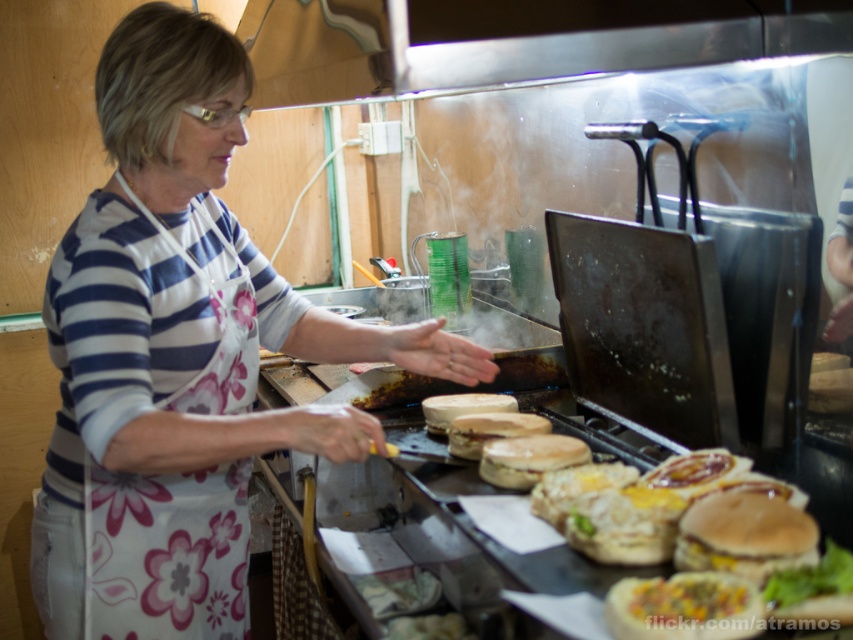
Question: Which object is the closest to the floral fabric apron at left?

Choices:
 (A) slightly toasted bun at center
 (B) brown toasted bun at center
 (C) breaded golden-brown hamburger at center

Answer: (B)

Question: Is the position of floral fabric apron at left more distant than that of breaded golden-brown hamburger at center?

Choices:
 (A) no
 (B) yes

Answer: (B)

Question: Is golden crispy burger bun at center above slightly toasted bun at center?

Choices:
 (A) no
 (B) yes

Answer: (A)

Question: Does white floral apron at center have a larger size compared to breaded golden-brown hamburger at center?

Choices:
 (A) no
 (B) yes

Answer: (B)

Question: Which point is farther to the camera?

Choices:
 (A) (495, 419)
 (B) (77, 480)
 (C) (572, 458)
 (D) (785, 564)

Answer: (A)

Question: Which point is farther to the camera?

Choices:
 (A) white floral apron at center
 (B) brown toasted bun at center

Answer: (B)